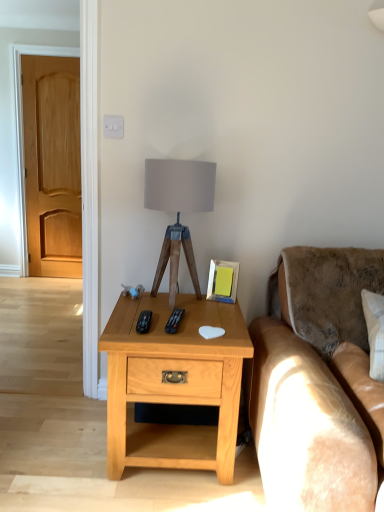
The width and height of the screenshot is (384, 512). In order to click on free spot in front of black plastic remote at center, the 2th remote viewed from the right in this screenshot , I will do `click(150, 335)`.